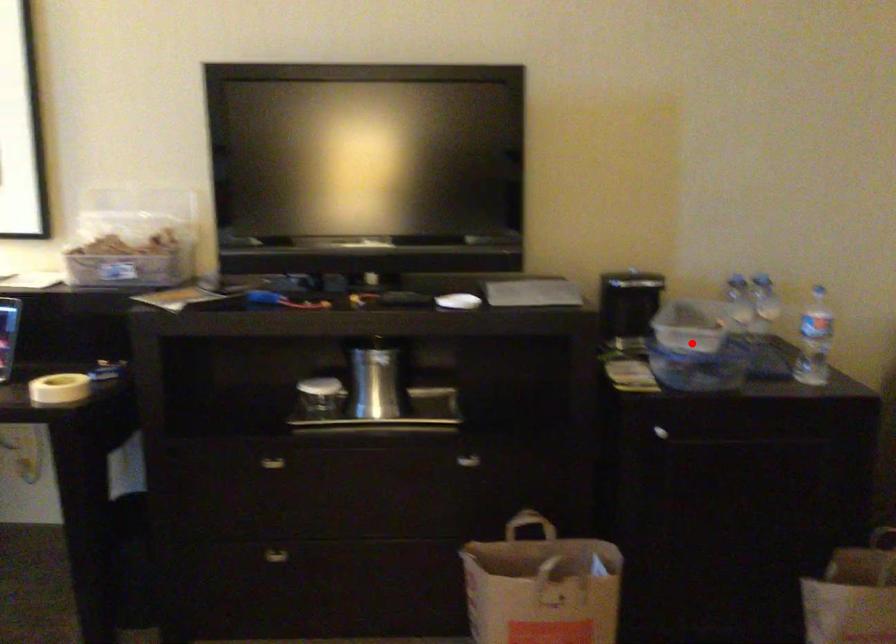
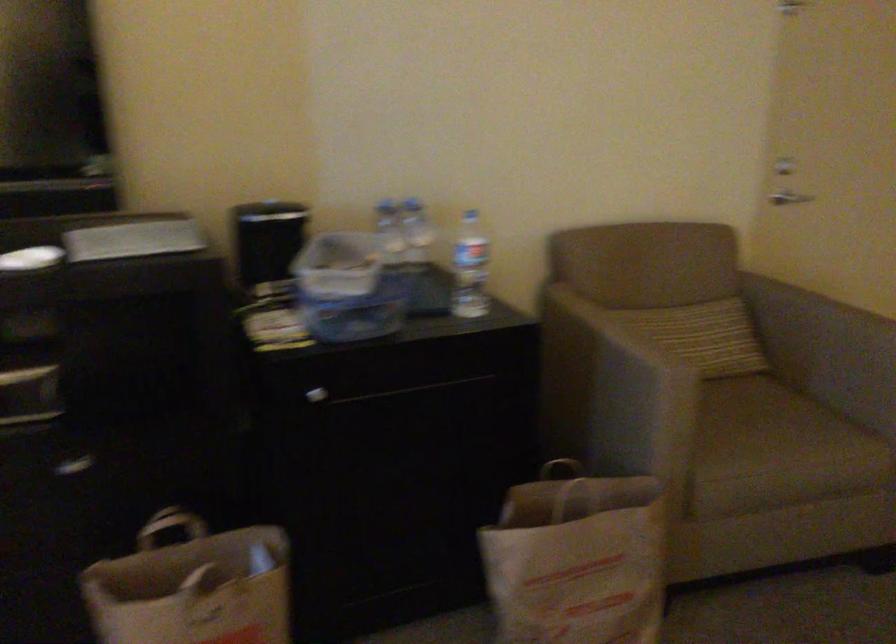
Question: I am providing you with two images of the same scene from different viewpoints. In image1, a red point is highlighted. Considering the same 3D point in image2, which of the following is correct?

Choices:
 (A) It is closer
 (B) It is farther

Answer: (A)